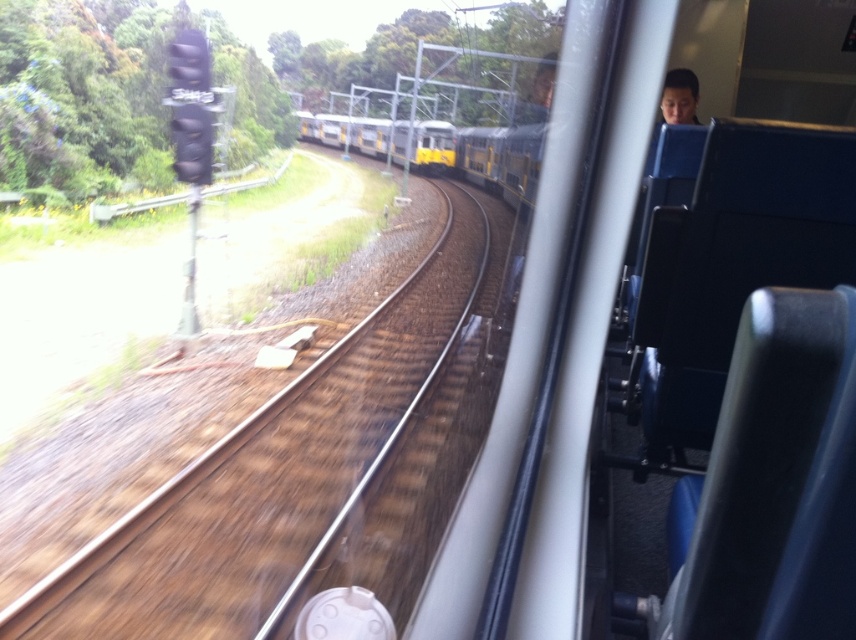
As you look out from the train window, you notice the yellow metallic train at center and the smooth skin face at upper right. Which object is located to the left of the other?

The yellow metallic train at center is positioned on the left side of smooth skin face at upper right.

You are a passenger on the train and want to know if the brown gravel train track at left is wider than the smooth skin face at upper right. Can you confirm this?

The brown gravel train track at left is wider than the smooth skin face at upper right according to the description.

You are standing at the point marked as point (x=138, y=516) inside the train. The train is moving forward. If you want to reach the front of the train quickly, should you walk towards the front or stay still?

You should walk towards the front because the distance between point (x=138, y=516) and the viewer is 3.92 meters, meaning the point is located behind the viewer. Walking towards the front would move you in the direction of motion, reducing the distance to the front faster than staying still.